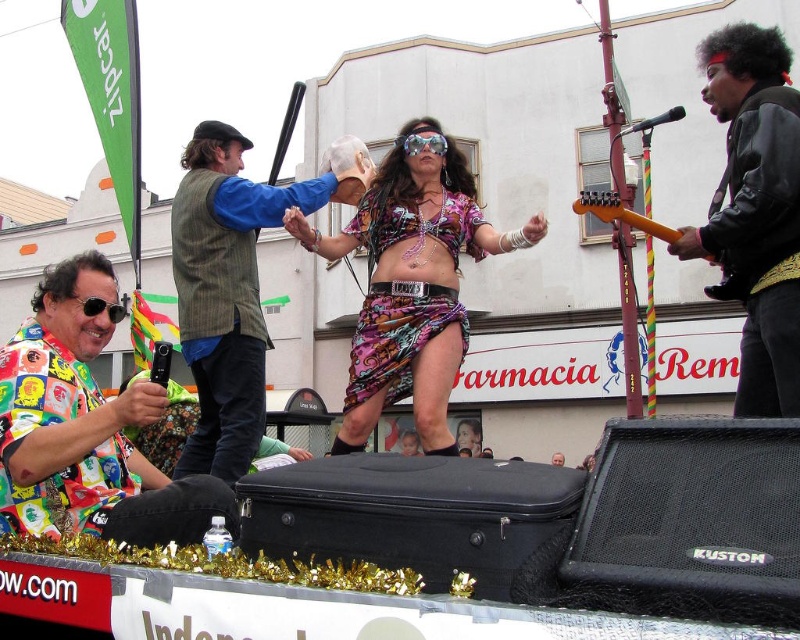
Which is below, black leather jacket at upper right or striped wool vest at center?

striped wool vest at center

Is point (758, 81) positioned behind point (234, 170)?

That is False.

Between point (728, 140) and point (280, 209), which one is positioned in front?

Point (728, 140)

Locate an element on the screen. black leather jacket at upper right is located at coordinates (756, 211).

Describe the element at coordinates (228, 289) in the screenshot. Image resolution: width=800 pixels, height=640 pixels. I see `striped wool vest at center` at that location.

From the picture: Can you confirm if striped wool vest at center is thinner than transparent plastic goggles at center?

No.

The height and width of the screenshot is (640, 800). I want to click on striped wool vest at center, so click(x=228, y=289).

Between point (297, 230) and point (412, 145), which one is positioned behind?

Positioned behind is point (412, 145).

Between printed fabric skirt at center and transparent plastic goggles at center, which one appears on the left side from the viewer's perspective?

From the viewer's perspective, printed fabric skirt at center appears more on the left side.

Between point (449, 300) and point (437, 134), which one is positioned behind?

Positioned behind is point (437, 134).

At what (x,y) coordinates should I click in order to perform the action: click on printed fabric skirt at center. Please return your answer as a coordinate pair (x, y). This screenshot has height=640, width=800. Looking at the image, I should click on (412, 285).